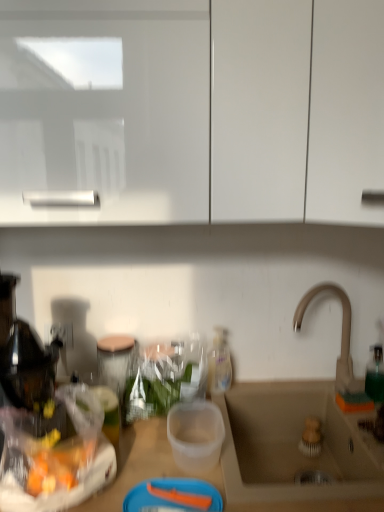
Question: Considering the positions of translucent plastic bottle at center and beige ceramic sink at lower right in the image, is translucent plastic bottle at center bigger or smaller than beige ceramic sink at lower right?

Choices:
 (A) big
 (B) small

Answer: (B)

Question: In terms of width, does translucent plastic bottle at center look wider or thinner when compared to beige ceramic sink at lower right?

Choices:
 (A) thin
 (B) wide

Answer: (A)

Question: Which is farther from the beige ceramic sink at lower right?

Choices:
 (A) translucent plastic bottle at center
 (B) satin nickel faucet at sink right
 (C) white glossy cabinet at upper center

Answer: (C)

Question: Which is nearer to the satin nickel faucet at sink right?

Choices:
 (A) translucent plastic bottle at center
 (B) white glossy cabinet at upper center
 (C) beige ceramic sink at lower right

Answer: (C)